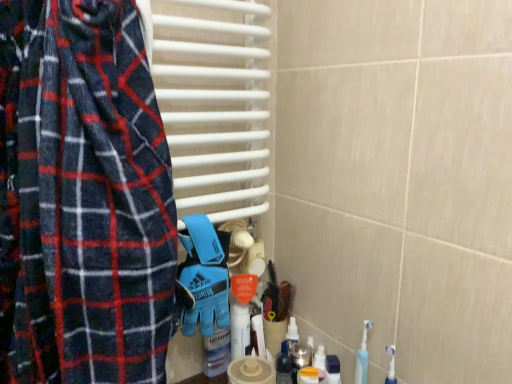
Question: Should I look upward or downward to see white glossy bottle at center?

Choices:
 (A) down
 (B) up

Answer: (A)

Question: Is blue synthetic glove at center outside white glossy bottle at center?

Choices:
 (A) yes
 (B) no

Answer: (A)

Question: Is blue synthetic glove at center facing towards white glossy bottle at center?

Choices:
 (A) no
 (B) yes

Answer: (A)

Question: Would you say blue synthetic glove at center is a long distance from white glossy bottle at center?

Choices:
 (A) yes
 (B) no

Answer: (B)

Question: Does blue synthetic glove at center have a greater width compared to white glossy bottle at center?

Choices:
 (A) yes
 (B) no

Answer: (A)

Question: Does blue synthetic glove at center have a lesser width compared to white glossy bottle at center?

Choices:
 (A) yes
 (B) no

Answer: (B)

Question: From the image's perspective, is blue synthetic glove at center above white glossy bottle at center?

Choices:
 (A) no
 (B) yes

Answer: (B)

Question: Is translucent plastic bottle at lower center thinner than blue synthetic glove at center?

Choices:
 (A) yes
 (B) no

Answer: (A)

Question: Is translucent plastic bottle at lower center taller than blue synthetic glove at center?

Choices:
 (A) yes
 (B) no

Answer: (B)

Question: Is translucent plastic bottle at lower center positioned in front of blue synthetic glove at center?

Choices:
 (A) yes
 (B) no

Answer: (B)

Question: From the image's perspective, is translucent plastic bottle at lower center located beneath blue synthetic glove at center?

Choices:
 (A) yes
 (B) no

Answer: (A)

Question: Does translucent plastic bottle at lower center contain blue synthetic glove at center?

Choices:
 (A) yes
 (B) no

Answer: (B)

Question: Considering the relative positions of translucent plastic bottle at lower center and blue synthetic glove at center in the image provided, is translucent plastic bottle at lower center to the left of blue synthetic glove at center from the viewer's perspective?

Choices:
 (A) yes
 (B) no

Answer: (B)

Question: Is white glossy bottle at center far away from blue synthetic glove at center?

Choices:
 (A) yes
 (B) no

Answer: (B)